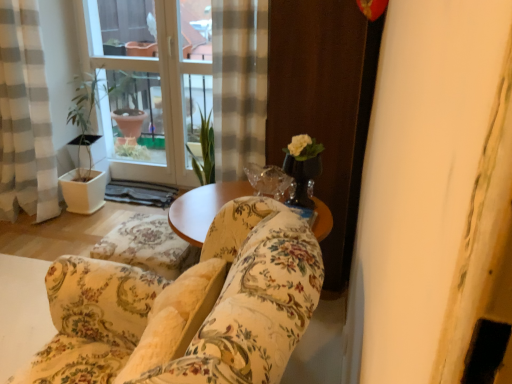
Question: From the image's perspective, is transparent glass vase at center positioned above or below floral fabric couch at center?

Choices:
 (A) above
 (B) below

Answer: (A)

Question: In the image, is transparent glass vase at center on the left side or the right side of floral fabric couch at center?

Choices:
 (A) right
 (B) left

Answer: (A)

Question: Considering the real-world distances, which object is farthest from the floral fabric sofa at center?

Choices:
 (A) wooden screen door at right
 (B) transparent glass vase at center
 (C) floral fabric couch at center
 (D) transparent glass window at upper left
 (E) gray checkered curtain at left

Answer: (D)

Question: Which of these objects is positioned farthest from the gray checkered curtain at left?

Choices:
 (A) floral fabric couch at center
 (B) transparent glass vase at center
 (C) wooden screen door at right
 (D) transparent glass window at upper left
 (E) floral fabric sofa at center

Answer: (B)